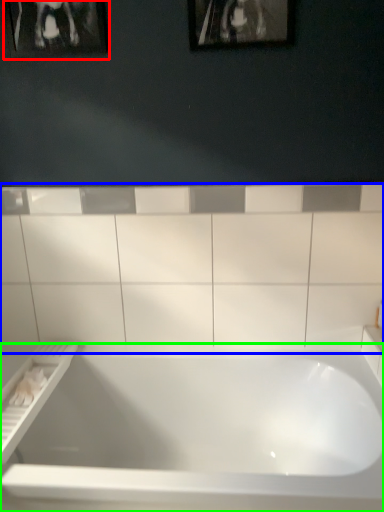
Question: Based on their relative distances, which object is nearer to picture frame (highlighted by a red box)? Choose from ceramic tile (highlighted by a blue box) and bathtub (highlighted by a green box).

Choices:
 (A) ceramic tile
 (B) bathtub

Answer: (A)